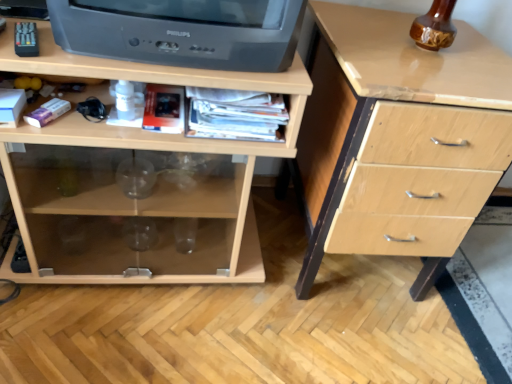
The height and width of the screenshot is (384, 512). Identify the location of vacant area that lies in front of light wood chest of drawers at right, the 2th chest of drawers viewed from the left. (337, 341).